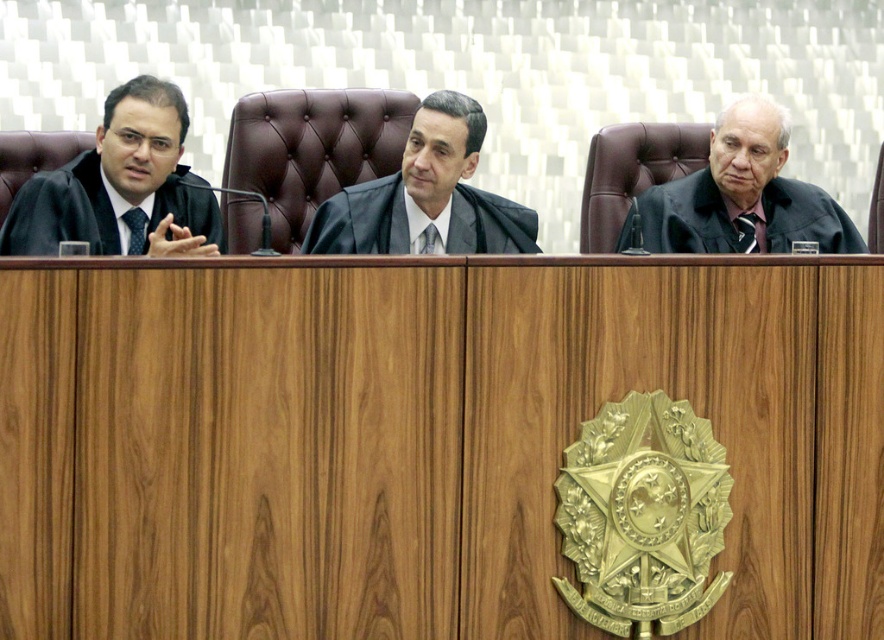
Does point (90, 170) come farther from viewer compared to point (429, 150)?

No, it is not.

Between matte black robe at left and black matte judge at center, which one has less height?

black matte judge at center is shorter.

I want to click on matte black robe at left, so click(120, 186).

Which is above, matte black robe at left or black matte judge at right?

black matte judge at right is higher up.

Does point (119, 99) come behind point (659, 230)?

No.

Measure the distance between point (189,244) and camera.

Point (189,244) is 15.45 feet from camera.

The width and height of the screenshot is (884, 640). I want to click on matte black robe at left, so click(x=120, y=186).

Is point (654, 232) closer to camera compared to point (504, 225)?

No, (654, 232) is further to viewer.

Who is positioned more to the right, black matte judge at right or black matte judge at center?

From the viewer's perspective, black matte judge at right appears more on the right side.

Is point (728, 196) less distant than point (311, 248)?

No.

Identify the location of black matte judge at right. (741, 195).